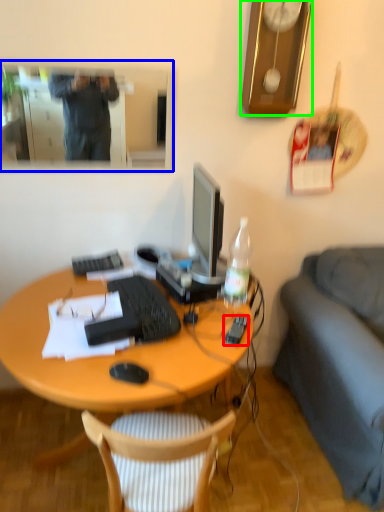
Question: Which is farther away from remote control (highlighted by a red box)? mirror (highlighted by a blue box) or clock (highlighted by a green box)?

Choices:
 (A) mirror
 (B) clock

Answer: (A)